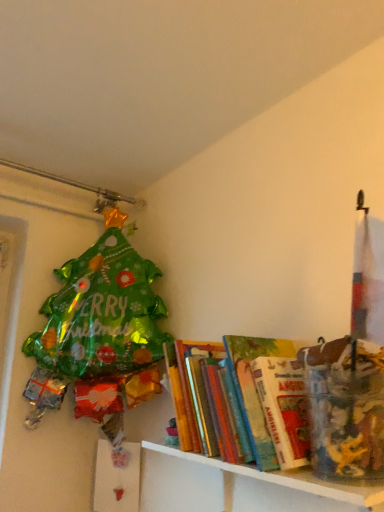
The width and height of the screenshot is (384, 512). Find the location of `hardcover books at center`. hardcover books at center is located at coordinates (255, 396).

Image resolution: width=384 pixels, height=512 pixels. What do you see at coordinates (255, 396) in the screenshot? I see `hardcover books at center` at bounding box center [255, 396].

The width and height of the screenshot is (384, 512). Describe the element at coordinates (286, 478) in the screenshot. I see `white glossy shelf at lower right` at that location.

The width and height of the screenshot is (384, 512). Find the location of `white glossy shelf at lower right`. white glossy shelf at lower right is located at coordinates (286, 478).

Locate an element on the screen. hardcover books at center is located at coordinates (255, 396).

Which object is positioned more to the right, white glossy shelf at lower right or hardcover books at center?

white glossy shelf at lower right is more to the right.

Is white glossy shelf at lower right closer to camera compared to hardcover books at center?

Yes, white glossy shelf at lower right is closer to the camera.

Between point (307, 482) and point (224, 412), which one is positioned behind?

The point (224, 412) is more distant.

From the image's perspective, is white glossy shelf at lower right over hardcover books at center?

No, from the image's perspective, white glossy shelf at lower right is not on top of hardcover books at center.

From the picture: From a real-world perspective, who is located higher, white glossy shelf at lower right or hardcover books at center?

hardcover books at center, from a real-world perspective.

Considering the sizes of objects white glossy shelf at lower right and hardcover books at center in the image provided, who is thinner, white glossy shelf at lower right or hardcover books at center?

Thinner between the two is white glossy shelf at lower right.

Is white glossy shelf at lower right taller or shorter than hardcover books at center?

Considering their sizes, white glossy shelf at lower right has less height than hardcover books at center.

From the picture: Which of these two, white glossy shelf at lower right or hardcover books at center, is smaller?

Smaller between the two is hardcover books at center.

From the picture: Is white glossy shelf at lower right not within hardcover books at center?

white glossy shelf at lower right is positioned outside hardcover books at center.

Is white glossy shelf at lower right next to hardcover books at center?

No, white glossy shelf at lower right is not making contact with hardcover books at center.

Is white glossy shelf at lower right positioned with its back to hardcover books at center?

No, white glossy shelf at lower right is not facing away from hardcover books at center.

In the scene shown: How many degrees apart are the facing directions of white glossy shelf at lower right and hardcover books at center?

white glossy shelf at lower right and hardcover books at center are facing 0.00127 degrees away from each other.

Consider the image. Measure the distance from white glossy shelf at lower right to hardcover books at center.

A distance of 4.89 inches exists between white glossy shelf at lower right and hardcover books at center.

Locate an element on the screen. This screenshot has height=512, width=384. shelf on the right of the hardcover books at center is located at coordinates point(286,478).

Considering the relative positions of hardcover books at center and white glossy shelf at lower right in the image provided, is hardcover books at center to the left or to the right of white glossy shelf at lower right?

hardcover books at center is positioned on white glossy shelf at lower right's left side.

Which is in front, hardcover books at center or white glossy shelf at lower right?

white glossy shelf at lower right is in front.

Considering the positions of point (252, 377) and point (274, 475), is point (252, 377) closer or farther from the camera than point (274, 475)?

Clearly, point (252, 377) is more distant from the camera than point (274, 475).

From the image's perspective, is hardcover books at center positioned above or below white glossy shelf at lower right?

Based on their image positions, hardcover books at center is located above white glossy shelf at lower right.

From a real-world perspective, is hardcover books at center physically below white glossy shelf at lower right?

No, from a real-world perspective, hardcover books at center is not beneath white glossy shelf at lower right.

Between hardcover books at center and white glossy shelf at lower right, which one has larger width?

hardcover books at center is wider.

From their relative heights in the image, would you say hardcover books at center is taller or shorter than white glossy shelf at lower right?

In the image, hardcover books at center appears to be taller than white glossy shelf at lower right.

Can you confirm if hardcover books at center is smaller than white glossy shelf at lower right?

Indeed, hardcover books at center has a smaller size compared to white glossy shelf at lower right.

Is hardcover books at center not inside white glossy shelf at lower right?

Absolutely, hardcover books at center is external to white glossy shelf at lower right.

Is hardcover books at center touching white glossy shelf at lower right?

No, hardcover books at center is not with white glossy shelf at lower right.

Could you tell me if hardcover books at center is turned towards white glossy shelf at lower right?

No, hardcover books at center is not oriented towards white glossy shelf at lower right.

What's the angular difference between hardcover books at center and white glossy shelf at lower right's facing directions?

They differ by 0.00127 degrees in their facing directions.

How far apart are hardcover books at center and white glossy shelf at lower right?

hardcover books at center is 12.41 centimeters away from white glossy shelf at lower right.

This screenshot has width=384, height=512. I want to click on book on the left of white glossy shelf at lower right, so click(x=255, y=396).

Image resolution: width=384 pixels, height=512 pixels. I want to click on shelf on the right side of hardcover books at center, so click(x=286, y=478).

Image resolution: width=384 pixels, height=512 pixels. I want to click on book on the left of white glossy shelf at lower right, so click(x=255, y=396).